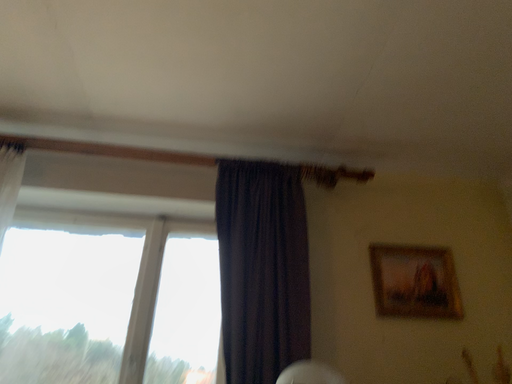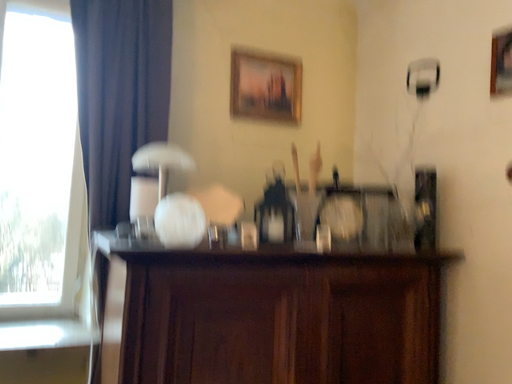
Question: How did the camera likely rotate when shooting the video?

Choices:
 (A) rotated right
 (B) rotated left

Answer: (A)